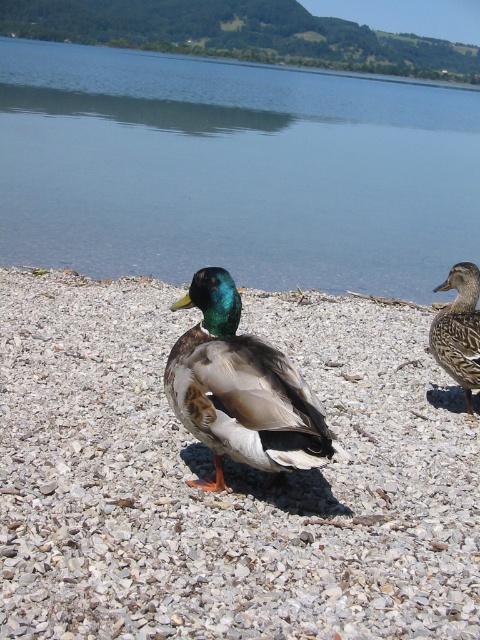
Question: Which point is closer to the camera taking this photo?

Choices:
 (A) (476, 280)
 (B) (216, 371)
 (C) (387, 490)

Answer: (B)

Question: Is shiny green and brown duck at center positioned behind green glossy duck at right?

Choices:
 (A) yes
 (B) no

Answer: (B)

Question: Which of the following is the farthest from the observer?

Choices:
 (A) (327, 230)
 (B) (278, 365)
 (C) (142, 518)
 (D) (460, 368)

Answer: (A)

Question: Is transparent water at center smaller than shiny green and brown duck at center?

Choices:
 (A) no
 (B) yes

Answer: (A)

Question: Which object is positioned closest to the transparent water at center?

Choices:
 (A) green glossy duck at right
 (B) shiny green and brown duck at center

Answer: (B)

Question: Does transparent water at center appear over green glossy duck at right?

Choices:
 (A) no
 (B) yes

Answer: (B)